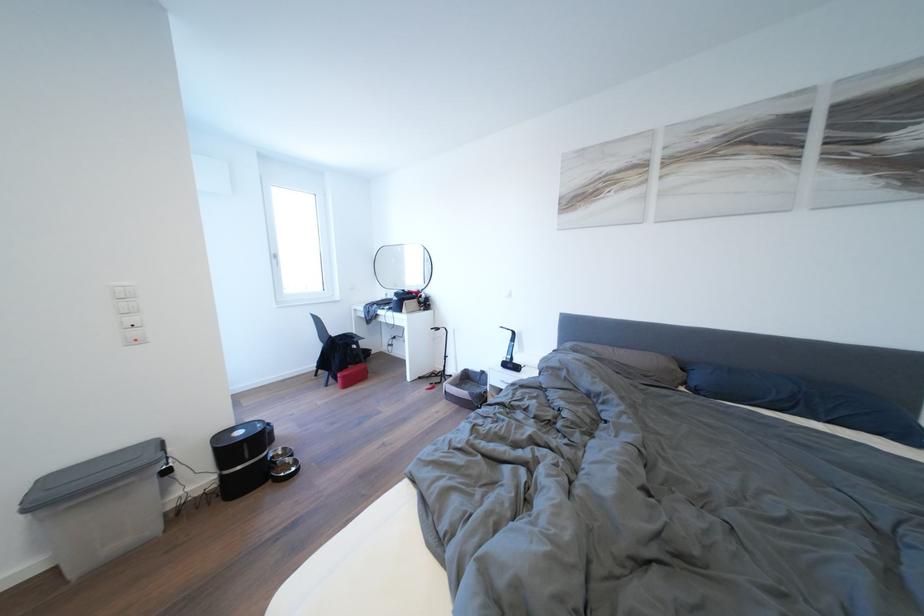
Find the location of a particular element. white wall switch is located at coordinates (123, 292).